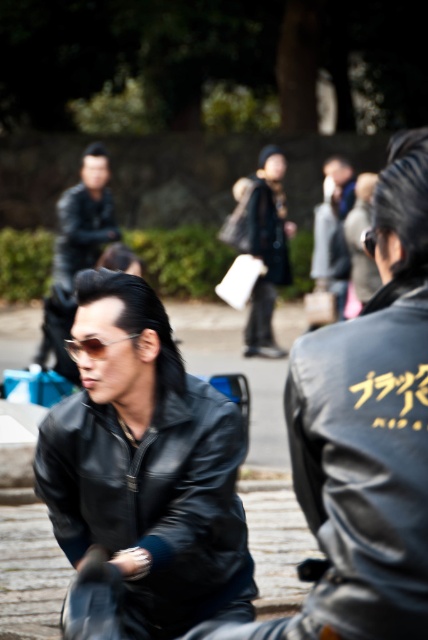
Is point (196, 486) farther from viewer compared to point (42, 355)?

No, (196, 486) is closer to viewer.

Does matte black leather jacket at center have a greater height compared to matte black leather jacket at upper left?

Indeed, matte black leather jacket at center has a greater height compared to matte black leather jacket at upper left.

Which is behind, point (174, 620) or point (56, 317)?

The point (56, 317) is behind.

Locate an element on the screen. matte black leather jacket at center is located at coordinates (146, 467).

Who is positioned more to the left, black leather jacket at center or matte black leather jacket at upper left?

matte black leather jacket at upper left is more to the left.

Is black leather jacket at center above matte black leather jacket at upper left?

No, black leather jacket at center is not above matte black leather jacket at upper left.

Is point (359, 504) positioned behind point (86, 216)?

No, it is not.

Where is `black leather jacket at center`? Image resolution: width=428 pixels, height=640 pixels. black leather jacket at center is located at coordinates (365, 435).

In the scene shown: Is the position of matte black leather jacket at center less distant than that of black leather jacket at center?

That is False.

Is point (62, 518) positioned behind point (288, 381)?

Yes, point (62, 518) is behind point (288, 381).

Who is more forward, (122,404) or (306,436)?

Point (306,436) is more forward.

Locate an element on the screen. matte black leather jacket at center is located at coordinates (146, 467).